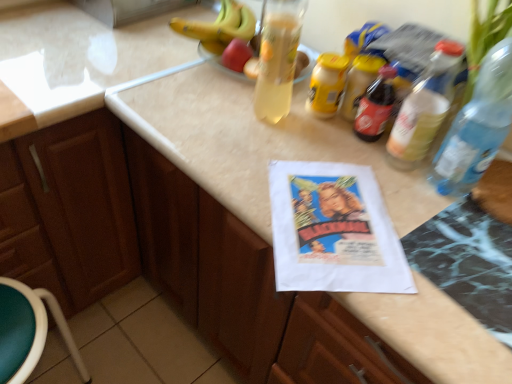
You are a GUI agent. You are given a task and a screenshot of the screen. Output one action in this format:
    pyautogui.click(x=<x>, y=<y>)
    Task: Click on the vacant area on the back side of green plastic stool at lower left
    This screenshot has height=384, width=512.
    Given the screenshot: What is the action you would take?
    pyautogui.click(x=125, y=343)